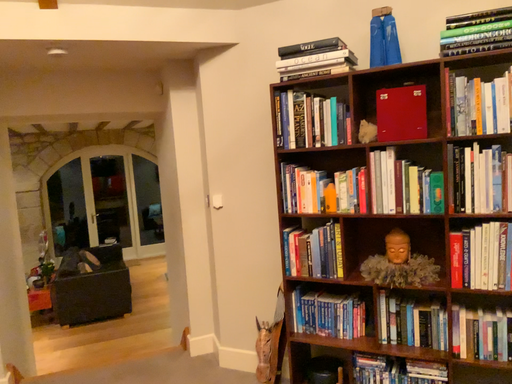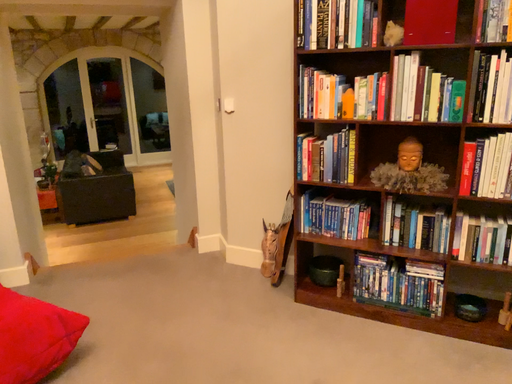
Question: Which way did the camera rotate in the video?

Choices:
 (A) rotated downward
 (B) rotated upward

Answer: (A)